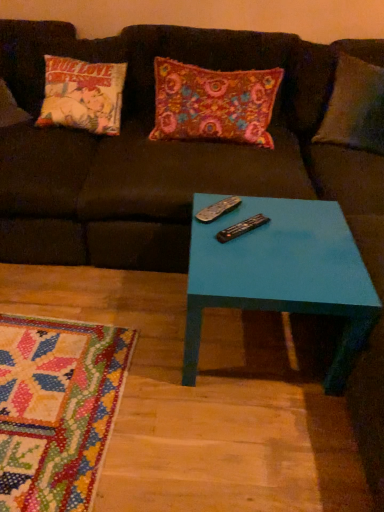
The width and height of the screenshot is (384, 512). I want to click on vacant region to the right of black plastic remote at center, which is the first remote in front-to-back order, so click(288, 237).